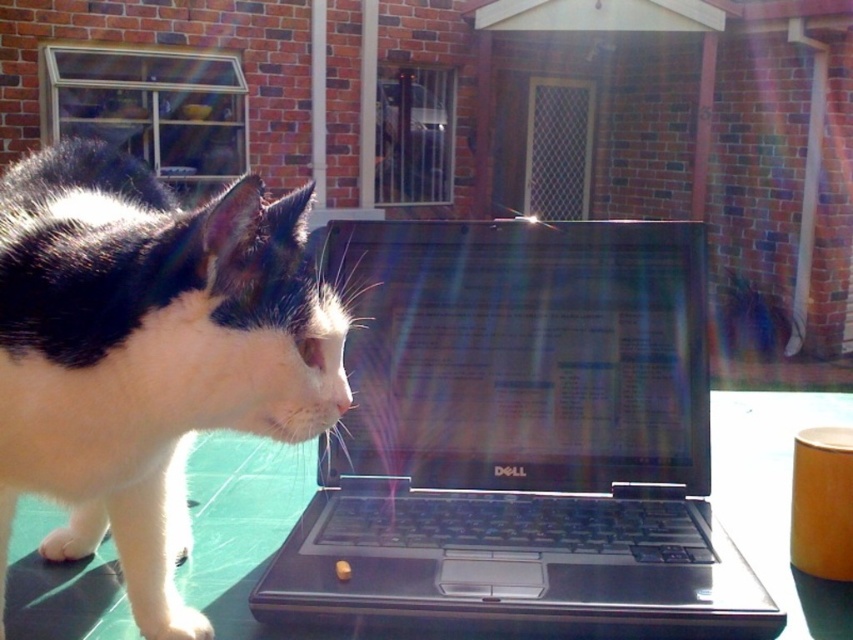
Question: Which point is farther to the camera?

Choices:
 (A) black plastic laptop at center
 (B) green glossy table at center
 (C) black and white fur cat at left

Answer: (B)

Question: Is black plastic laptop at center thinner than green glossy table at center?

Choices:
 (A) yes
 (B) no

Answer: (A)

Question: Which point appears closest to the camera in this image?

Choices:
 (A) (680, 573)
 (B) (9, 506)

Answer: (B)

Question: Does black plastic laptop at center have a smaller size compared to black and white fur cat at left?

Choices:
 (A) yes
 (B) no

Answer: (A)

Question: Which point is farther to the camera?

Choices:
 (A) (413, 548)
 (B) (305, 188)
 (C) (183, 579)

Answer: (B)

Question: Is black plastic laptop at center to the left of green glossy table at center from the viewer's perspective?

Choices:
 (A) yes
 (B) no

Answer: (A)